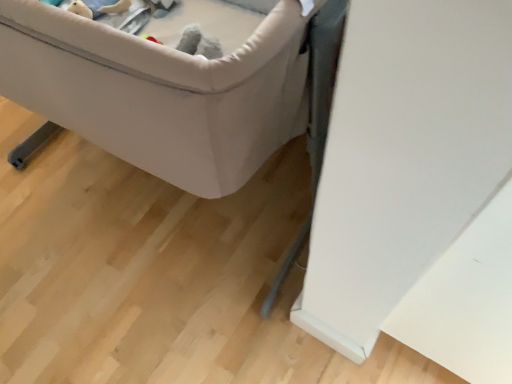
This screenshot has width=512, height=384. I want to click on light gray fabric crib at center, so click(x=161, y=92).

The image size is (512, 384). What do you see at coordinates (161, 92) in the screenshot?
I see `light gray fabric crib at center` at bounding box center [161, 92].

At what (x,y) coordinates should I click in order to perform the action: click on light gray fabric crib at center. Please return your answer as a coordinate pair (x, y). This screenshot has width=512, height=384. Looking at the image, I should click on (161, 92).